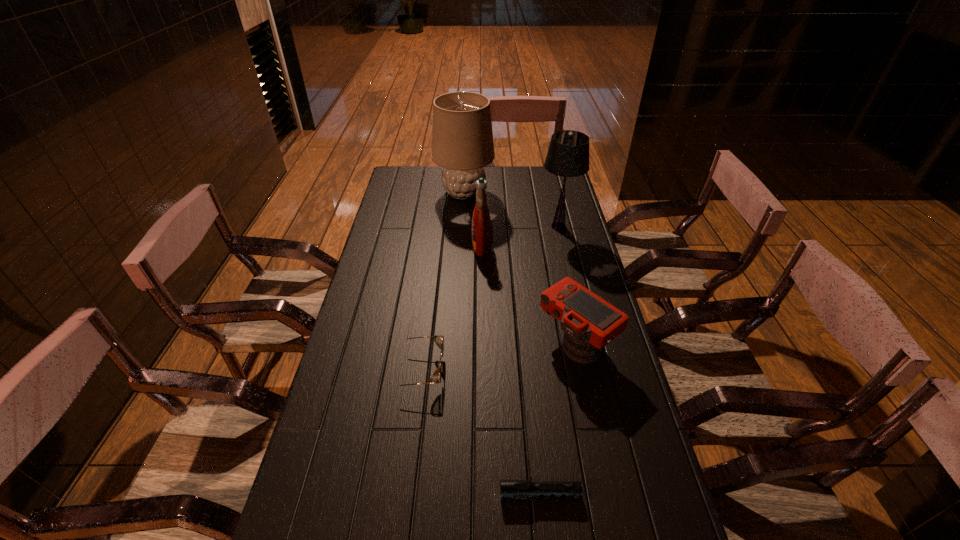
Where is `vacant area situated 0.100m on the front-facing side of the nearer lampshade`? vacant area situated 0.100m on the front-facing side of the nearer lampshade is located at coordinates (513, 226).

Locate an element on the screen. The image size is (960, 540). vacant area situated on the front-facing side of the nearer lampshade is located at coordinates (516, 226).

This screenshot has width=960, height=540. Identify the location of vacant region located 0.260m on the front surface of the detergent. (402, 245).

Where is `vacant position located on the front surface of the detergent`? The image size is (960, 540). vacant position located on the front surface of the detergent is located at coordinates (453, 245).

Image resolution: width=960 pixels, height=540 pixels. Find the location of `vacant area situated 0.300m on the front surface of the detergent`. vacant area situated 0.300m on the front surface of the detergent is located at coordinates (392, 245).

Image resolution: width=960 pixels, height=540 pixels. I want to click on vacant space situated on the back of the third shortest object, so click(564, 287).

Identify the location of vacant space located on the front lenses of the second shortest object. [483, 370].

This screenshot has height=540, width=960. Find the location of `vacant space situated 0.120m at the lens end of the shortest object`. vacant space situated 0.120m at the lens end of the shortest object is located at coordinates (445, 495).

Identify the location of free region located 0.300m at the lens end of the shortest object. (364, 495).

The image size is (960, 540). In order to click on vacant space positioned at the lens end of the shortest object in this screenshot , I will do `click(336, 495)`.